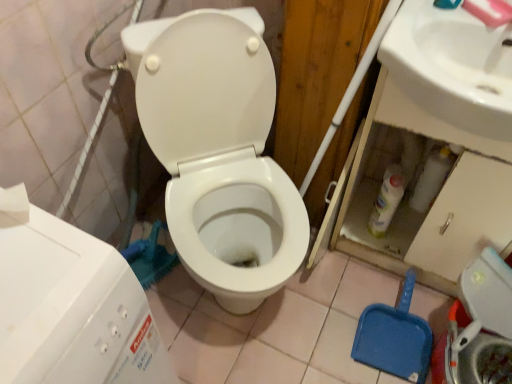
Question: Is white glossy sink at upper right in front of or behind white glossy toilet at center in the image?

Choices:
 (A) behind
 (B) front

Answer: (A)

Question: In terms of size, does white glossy sink at upper right appear bigger or smaller than white glossy toilet at center?

Choices:
 (A) small
 (B) big

Answer: (A)

Question: Considering the real-world distances, which object is closest to the white glossy toilet at center?

Choices:
 (A) white plastic water tank at lower left
 (B) white plastic washer at lower right
 (C) white glossy sink at upper right

Answer: (C)

Question: Estimate the real-world distances between objects in this image. Which object is closer to the white glossy toilet at center?

Choices:
 (A) white plastic water tank at lower left
 (B) white plastic washer at lower right
 (C) white glossy sink at upper right

Answer: (C)